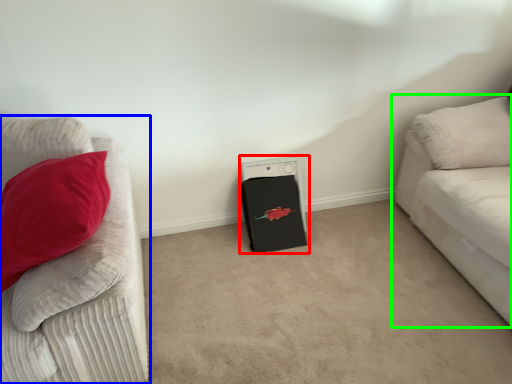
Question: Which object is the farthest from appliance (highlighted by a red box)? Choose among these: studio couch (highlighted by a blue box) or studio couch (highlighted by a green box).

Choices:
 (A) studio couch
 (B) studio couch

Answer: (A)